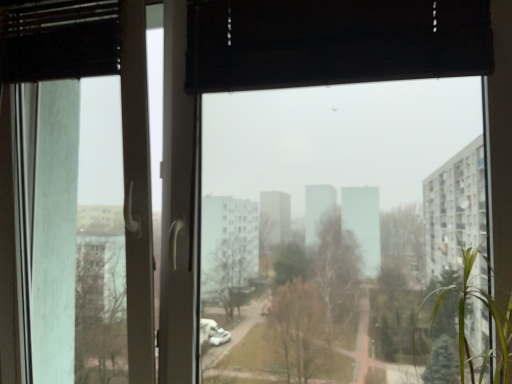
Describe the element at coordinates (334, 216) in the screenshot. I see `transparent glass window at center` at that location.

Identify the location of green leafy plant at right. The image size is (512, 384). (465, 316).

Is green leafy plant at right located within transparent glass screen door at left?

Definitely not — green leafy plant at right is not inside transparent glass screen door at left.

Does transparent glass screen door at left touch green leafy plant at right?

transparent glass screen door at left and green leafy plant at right are not in contact.

Is transparent glass screen door at left aimed at green leafy plant at right?

No, transparent glass screen door at left is not oriented towards green leafy plant at right.

Is transparent glass screen door at left taller than green leafy plant at right?

Yes.

Is transparent glass window at center in contact with transparent glass screen door at left?

transparent glass window at center and transparent glass screen door at left are clearly separated.

Is point (354, 219) closer or farther from the camera than point (61, 49)?

Point (354, 219) is positioned closer to the camera compared to point (61, 49).

Is transparent glass window at center in front of or behind transparent glass screen door at left in the image?

Visually, transparent glass window at center is located in front of transparent glass screen door at left.

Does green leafy plant at right turn towards transparent glass screen door at left?

No, green leafy plant at right is not facing towards transparent glass screen door at left.

Can you confirm if green leafy plant at right is thinner than transparent glass screen door at left?

In fact, green leafy plant at right might be wider than transparent glass screen door at left.

In terms of height, does green leafy plant at right look taller or shorter compared to transparent glass screen door at left?

Considering their sizes, green leafy plant at right has less height than transparent glass screen door at left.

From the image's perspective, relative to transparent glass screen door at left, is green leafy plant at right above or below?

From the image's perspective, green leafy plant at right appears below transparent glass screen door at left.

Considering their positions, is transparent glass window at center located in front of or behind green leafy plant at right?

In the image, transparent glass window at center appears behind green leafy plant at right.

In the image, is transparent glass window at center on the left side or the right side of green leafy plant at right?

transparent glass window at center is to the left of green leafy plant at right.

Between transparent glass window at center and green leafy plant at right, which one has smaller width?

Thinner between the two is transparent glass window at center.

I want to click on tree located on the right of transparent glass window at center, so click(465, 316).

From the image's perspective, is green leafy plant at right located above or below transparent glass window at center?

Based on their image positions, green leafy plant at right is located beneath transparent glass window at center.

Considering the relative sizes of green leafy plant at right and transparent glass window at center in the image provided, is green leafy plant at right taller than transparent glass window at center?

In fact, green leafy plant at right may be shorter than transparent glass window at center.

Is green leafy plant at right positioned beyond the bounds of transparent glass window at center?

Yes.

Is point (503, 310) positioned after point (435, 244)?

That is False.

In the scene shown: Does transparent glass screen door at left have a greater height compared to transparent glass window at center?

Yes.

Considering the relative sizes of transparent glass screen door at left and transparent glass window at center in the image provided, is transparent glass screen door at left smaller than transparent glass window at center?

Actually, transparent glass screen door at left might be larger than transparent glass window at center.

How distant is transparent glass screen door at left from transparent glass window at center?

transparent glass screen door at left is 3.07 meters from transparent glass window at center.

Considering the sizes of objects transparent glass screen door at left and transparent glass window at center in the image provided, who is wider, transparent glass screen door at left or transparent glass window at center?

Wider between the two is transparent glass screen door at left.

Where is `tree directly beneath the transparent glass screen door at left (from a real-world perspective)`? tree directly beneath the transparent glass screen door at left (from a real-world perspective) is located at coordinates (465, 316).

The height and width of the screenshot is (384, 512). I want to click on window screen on the right of the transparent glass screen door at left, so click(334, 216).

From the picture: Estimate the real-world distances between objects in this image. Which object is further from green leafy plant at right, transparent glass window at center or transparent glass screen door at left?

The object further to green leafy plant at right is transparent glass window at center.

Which object lies further to the anchor point transparent glass window at center, transparent glass screen door at left or green leafy plant at right?

transparent glass screen door at left lies further to transparent glass window at center than the other object.

Looking at the image, which one is located closer to green leafy plant at right, transparent glass screen door at left or transparent glass window at center?

The object closer to green leafy plant at right is transparent glass screen door at left.

Looking at the image, which one is located closer to transparent glass screen door at left, green leafy plant at right or transparent glass window at center?

The object closer to transparent glass screen door at left is green leafy plant at right.

Based on their spatial positions, is green leafy plant at right or transparent glass screen door at left further from transparent glass window at center?

The object further to transparent glass window at center is transparent glass screen door at left.

Estimate the real-world distances between objects in this image. Which object is further from transparent glass screen door at left, transparent glass window at center or green leafy plant at right?

transparent glass window at center.

This screenshot has height=384, width=512. In order to click on window screen between transparent glass screen door at left and green leafy plant at right from left to right in this screenshot , I will do (x=334, y=216).